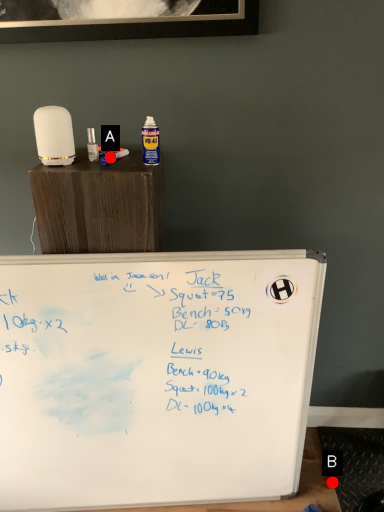
Question: Two points are circled on the image, labeled by A and B beside each circle. Which of the following is the farthest from the observer?

Choices:
 (A) A is further
 (B) B is further

Answer: (B)